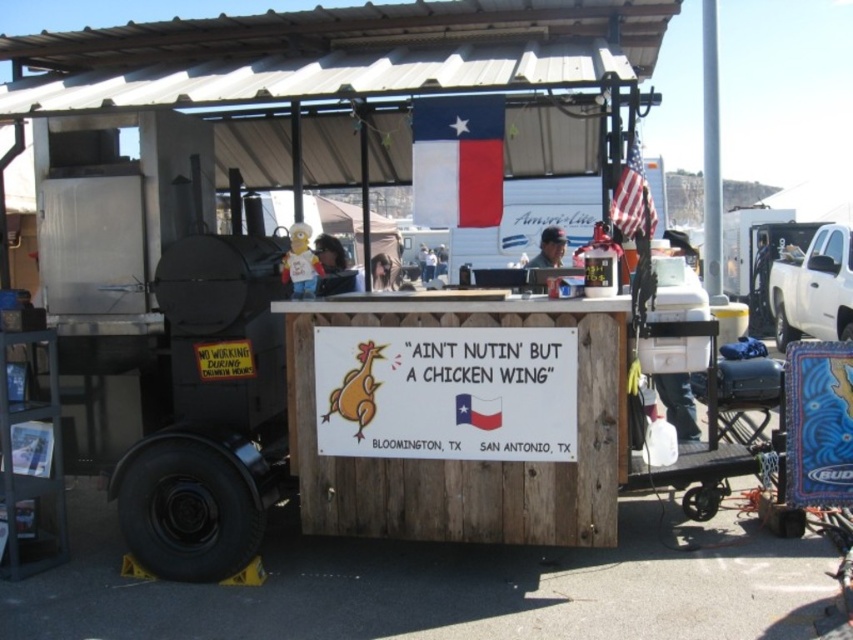
You are a customer at the food stall and want to take a photo with both the texas flag at center and the american flag at upper right in the background. Which flag should you position closer to the camera to ensure both are visible in the photo?

The texas flag at center should be positioned closer to the camera because it is larger than the american flag at upper right, ensuring both flags are visible in the photo.

You are a customer at the food stall and want to take a photo with the flags. The texas flag at center and the american flag at upper right are part of the setup. Which flag should you stand closer to if you want both flags to appear equally sized in your photo?

To have both flags appear equally sized in your photo, you should stand closer to the texas flag at center since it is located above the american flag at upper right, making it farther away from the camera. By moving closer to the closer flag, you can balance their apparent sizes.

You are a customer at the food stall and want to grab your drink from the white plastic cooler at right while your friend is wearing the dark brown leather jacket at center. Can you reach the cooler without moving past your friend?

The white plastic cooler at right is further to the viewer than dark brown leather jacket at center, so you can reach the cooler without moving past your friend.